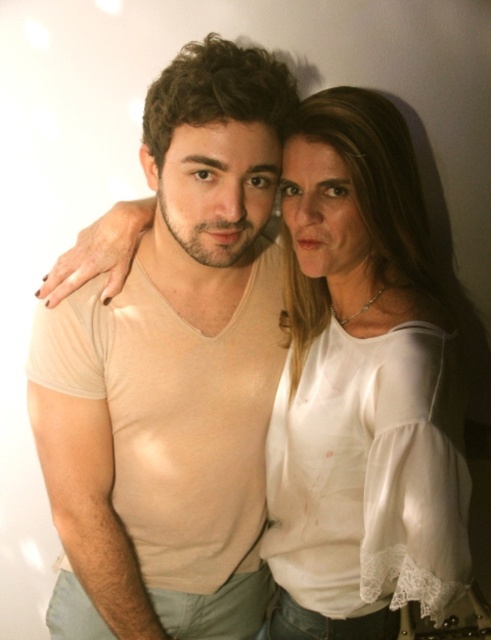
You are a GUI agent. You are given a task and a screenshot of the screen. Output one action in this format:
    pyautogui.click(x=<x>, y=<y>)
    Task: Click on the matte beige t-shirt at center
    
    Given the screenshot: What is the action you would take?
    click(x=172, y=372)

Is matte beige t-shirt at center taller than white satin blouse at center?

Indeed, matte beige t-shirt at center has a greater height compared to white satin blouse at center.

This screenshot has width=491, height=640. Find the location of `matte beige t-shirt at center`. matte beige t-shirt at center is located at coordinates (172, 372).